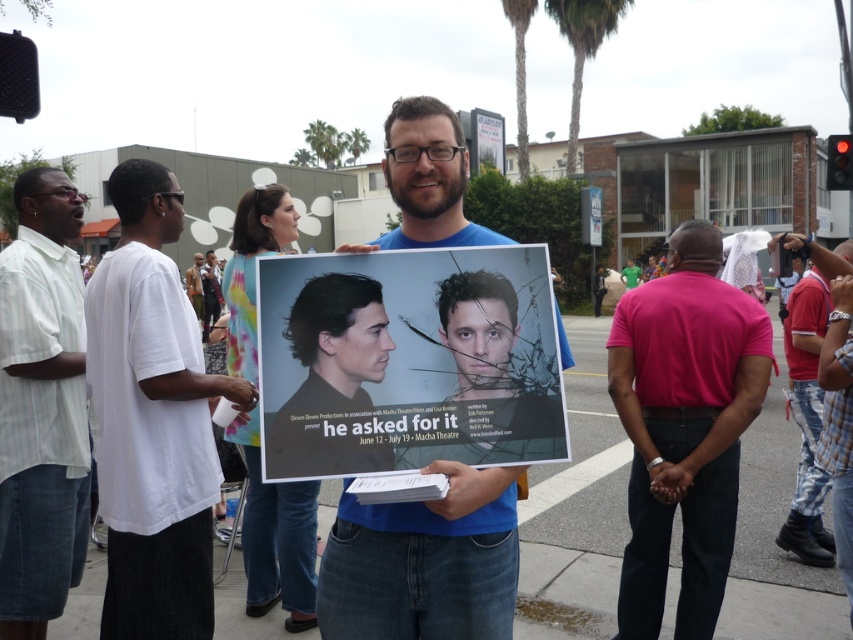
You are an event organizer at the Macha Theatre and you want to ensure that the white striped shirt at left and the plaid denim pants at lower right can be seen clearly in the promotional photo. Which object should be placed closer to the camera to ensure visibility?

The white striped shirt at left should be placed closer to the camera because it has a greater height compared to the plaid denim pants at lower right, making it more prominent in the photo.

You are a photographer standing at the point marked as point [683,428]. You want to take a photo of the promotional poster for the theatrical production titled He Asked For It. Is the promotional poster visible from your current position?

The point [683,428] is on pink cotton shirt at center, so the promotional poster is not visible from that position because the shirt is blocking the view.